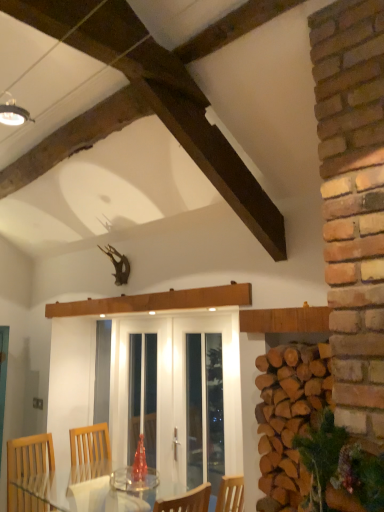
Question: Is natural brown woodpile at right to the left or to the right of white glass screen door at center, the 2th screen door viewed from the right, in the image?

Choices:
 (A) right
 (B) left

Answer: (A)

Question: From the image's perspective, is natural brown woodpile at right positioned above or below white glass screen door at center, the 2th screen door viewed from the right?

Choices:
 (A) below
 (B) above

Answer: (B)

Question: Estimate the real-world distances between objects in this image. Which object is closer to the natural brown woodpile at right?

Choices:
 (A) white glass door at center, the first screen door viewed from the right
 (B) white glass screen door at center, the 1th screen door positioned from the left

Answer: (A)

Question: Which object is positioned farthest from the white glass screen door at center, the 2th screen door viewed from the right?

Choices:
 (A) white glass door at center, the first screen door viewed from the right
 (B) natural brown woodpile at right

Answer: (B)